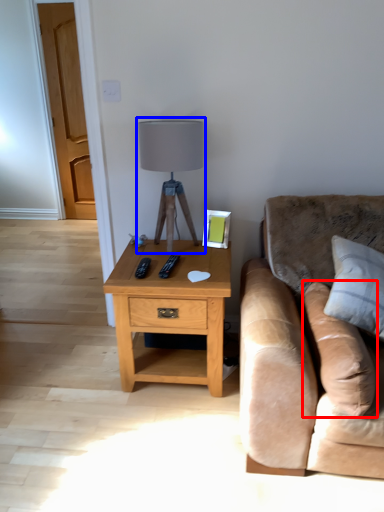
Question: Which of the following is the farthest to the observer, pillow (highlighted by a red box) or table lamp (highlighted by a blue box)?

Choices:
 (A) pillow
 (B) table lamp

Answer: (B)